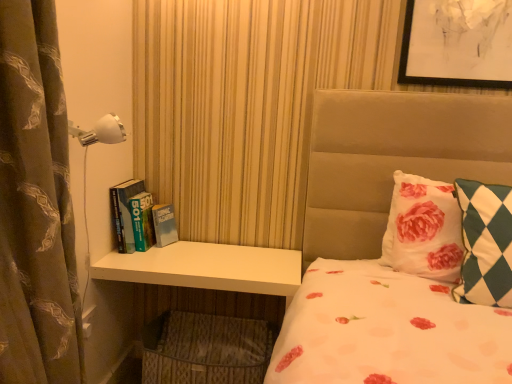
Question: Is green checkered pillow at right, marked as the second pillow in a back-to-front arrangement, in front of or behind white matte dresser at lower left in the image?

Choices:
 (A) behind
 (B) front

Answer: (B)

Question: Is green checkered pillow at right, marked as the second pillow in a back-to-front arrangement, situated inside white matte dresser at lower left or outside?

Choices:
 (A) outside
 (B) inside

Answer: (A)

Question: Which is nearer to the white floral pillow at upper right, acting as the 2th pillow starting from the front?

Choices:
 (A) white plastic lamp at upper left
 (B) green matte book at left
 (C) green checkered pillow at right, the first pillow in the front-to-back sequence
 (D) white matte dresser at lower left
 (E) brown printed fabric curtain at left

Answer: (C)

Question: Which is farther from the green matte book at left?

Choices:
 (A) white plastic lamp at upper left
 (B) white floral pillow at upper right, acting as the 2th pillow starting from the front
 (C) green checkered pillow at right, marked as the second pillow in a back-to-front arrangement
 (D) white matte dresser at lower left
 (E) brown printed fabric curtain at left

Answer: (C)